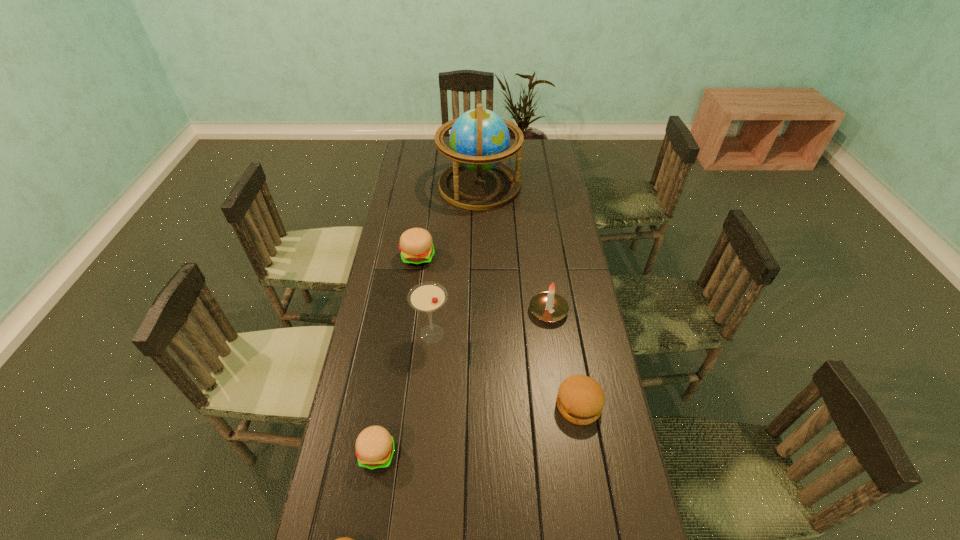
Locate an element on the screen. object that is the closest to the fourth tallest object is located at coordinates [x=479, y=139].

You are a GUI agent. You are given a task and a screenshot of the screen. Output one action in this format:
    pyautogui.click(x=<x>, y=<y>)
    Task: Click on the hamburger that is the third closest to the martini
    
    Given the screenshot: What is the action you would take?
    pyautogui.click(x=580, y=400)

Locate which hamburger is the second closest to the third farthest hamburger. Please provide its 2D coordinates. Your answer should be formatted as a tuple, i.e. [(x, y)], where the tuple contains the x and y coordinates of a point satisfying the conditions above.

[(580, 400)]

Identify the location of free space that satisfies the following two spatial constraints: 1. on the back side of the farthest object; 2. on the right side of the nearer beige hamburger. The height and width of the screenshot is (540, 960). (420, 186).